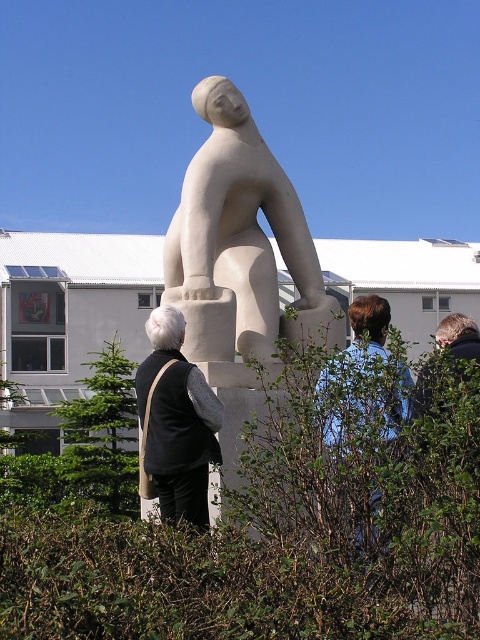
You are a gardener tasked with trimming the plants in the scene. The green leafy hedge at center and the green leafy bush at lower left need to be trimmed. Which one requires more time due to its size?

The green leafy hedge at center requires more time to trim because it has a larger size compared to the green leafy bush at lower left.

You are a photographer trying to capture a clear photo of the white stone statue at center without the green leafy hedge at center blocking the view. Based on their heights, can you position yourself so that the hedge doesn

The green leafy hedge at center is shorter than the white stone statue at center, so positioning yourself at a lower angle or closer to the base of the statue would allow the statue to be visible above the hedge.